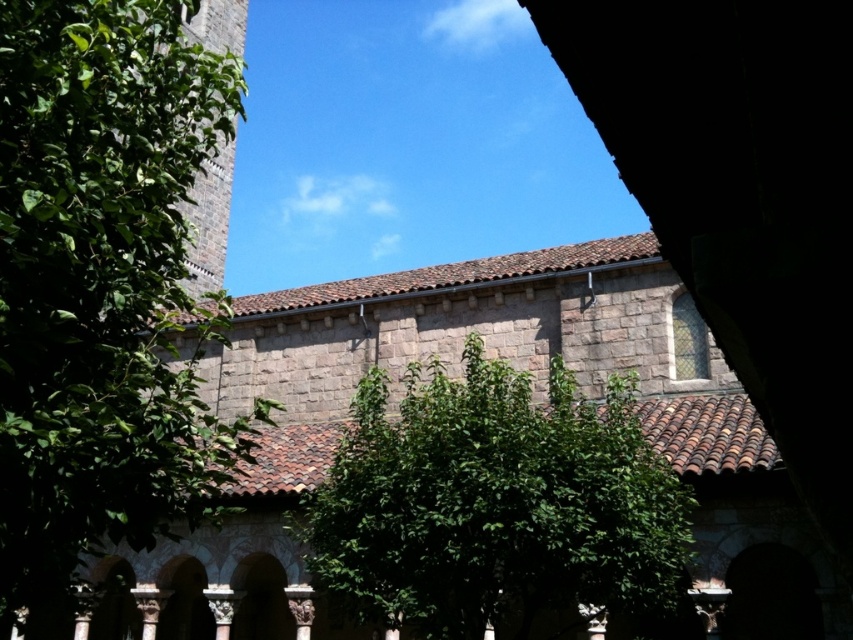
Question: Among these objects, which one is nearest to the camera?

Choices:
 (A) green leafy tree at upper left
 (B) green leafy tree at center

Answer: (A)

Question: Can you confirm if green leafy tree at upper left is positioned below green leafy tree at center?

Choices:
 (A) yes
 (B) no

Answer: (B)

Question: Is green leafy tree at upper left above green leafy tree at center?

Choices:
 (A) no
 (B) yes

Answer: (B)

Question: Which of the following is the farthest from the observer?

Choices:
 (A) (416, 472)
 (B) (149, 180)

Answer: (A)

Question: Is green leafy tree at upper left behind green leafy tree at center?

Choices:
 (A) no
 (B) yes

Answer: (A)

Question: Which object appears farthest from the camera in this image?

Choices:
 (A) green leafy tree at upper left
 (B) green leafy tree at center

Answer: (B)